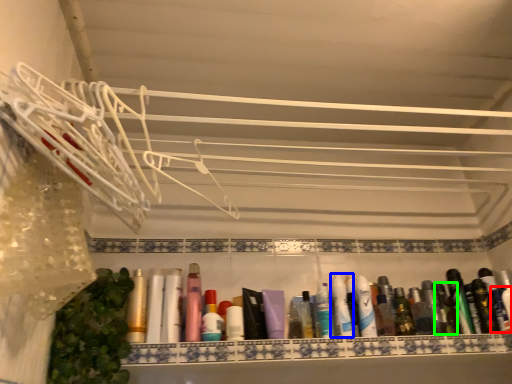
Question: Which object is the farthest from toiletry (highlighted by a red box)? Choose among these: toothpaste (highlighted by a blue box) or toiletry (highlighted by a green box).

Choices:
 (A) toothpaste
 (B) toiletry

Answer: (A)